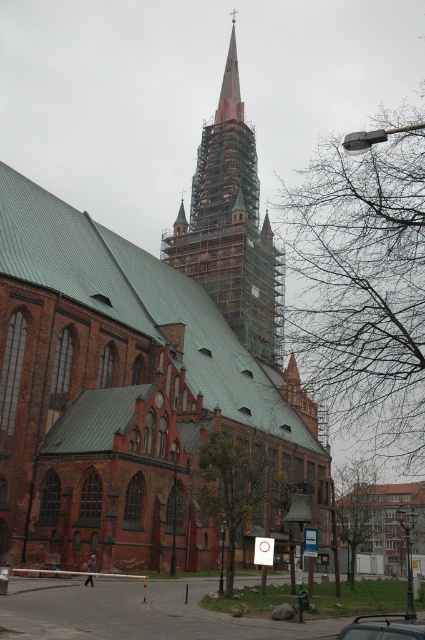
Does point (51, 541) come in front of point (175, 230)?

Yes, it is.

Between brown brick church at center and wooden scaffolding at center, which one has less height?

wooden scaffolding at center is shorter.

Is point (255, 356) positioned in front of point (232, 173)?

Yes, it is in front of point (232, 173).

This screenshot has height=640, width=425. Identify the location of brown brick church at center. (144, 369).

Which of these two, wooden scaffolding at center or metallic silver car at center, stands shorter?

metallic silver car at center is shorter.

Can you confirm if wooden scaffolding at center is taller than metallic silver car at center?

Correct, wooden scaffolding at center is much taller as metallic silver car at center.

You are a GUI agent. You are given a task and a screenshot of the screen. Output one action in this format:
    pyautogui.click(x=<x>, y=<y>)
    Task: Click on the wooden scaffolding at center
    This screenshot has height=640, width=425.
    Given the screenshot: What is the action you would take?
    pyautogui.click(x=232, y=227)

Who is more forward, [149,269] or [399,636]?

A: Point [399,636] is more forward.

Between brown brick church at center and metallic silver car at center, which one appears on the right side from the viewer's perspective?

Positioned to the right is metallic silver car at center.

The width and height of the screenshot is (425, 640). What do you see at coordinates (144, 369) in the screenshot?
I see `brown brick church at center` at bounding box center [144, 369].

Locate an element on the screen. brown brick church at center is located at coordinates (144, 369).